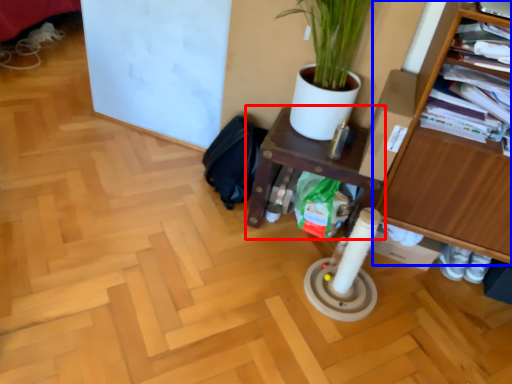
Question: Which object is further to the camera taking this photo, shelf (highlighted by a red box) or furniture (highlighted by a blue box)?

Choices:
 (A) shelf
 (B) furniture

Answer: (A)